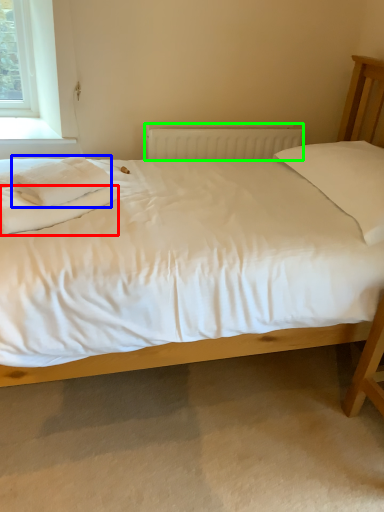
Question: Based on their relative distances, which object is nearer to sheet (highlighted by a red box)? Choose from material (highlighted by a blue box) and radiator (highlighted by a green box).

Choices:
 (A) material
 (B) radiator

Answer: (A)